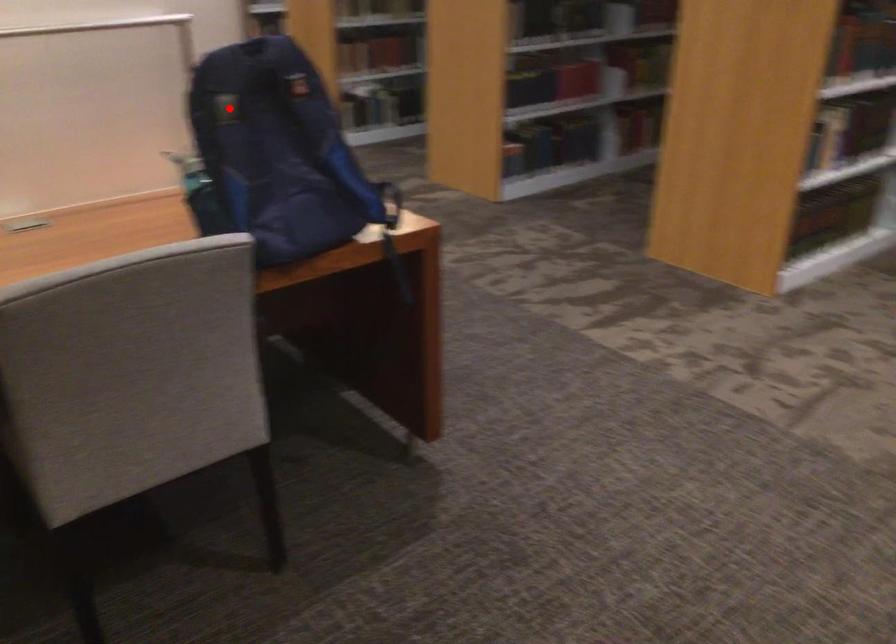
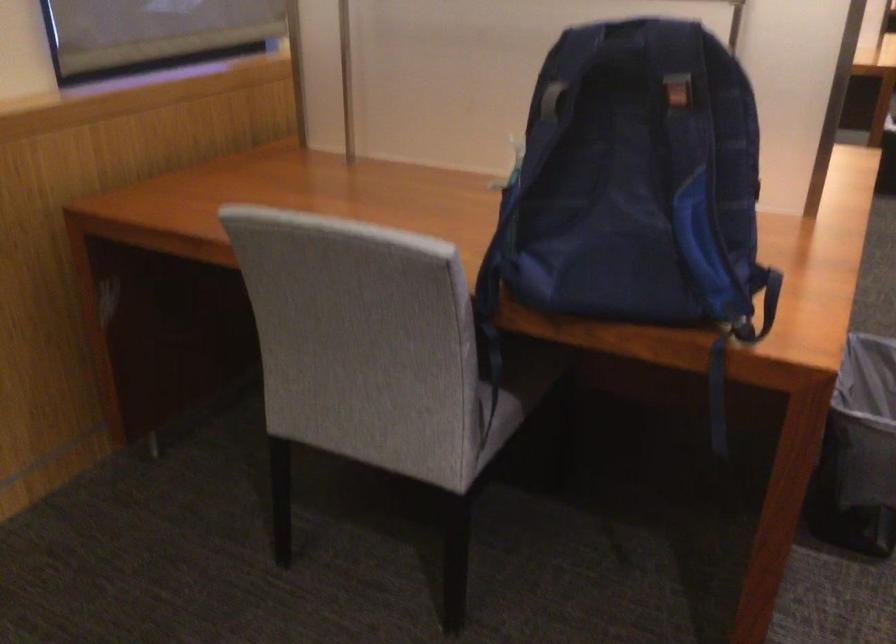
Where in the second image is the point corresponding to the highlighted location from the first image?

(552, 100)